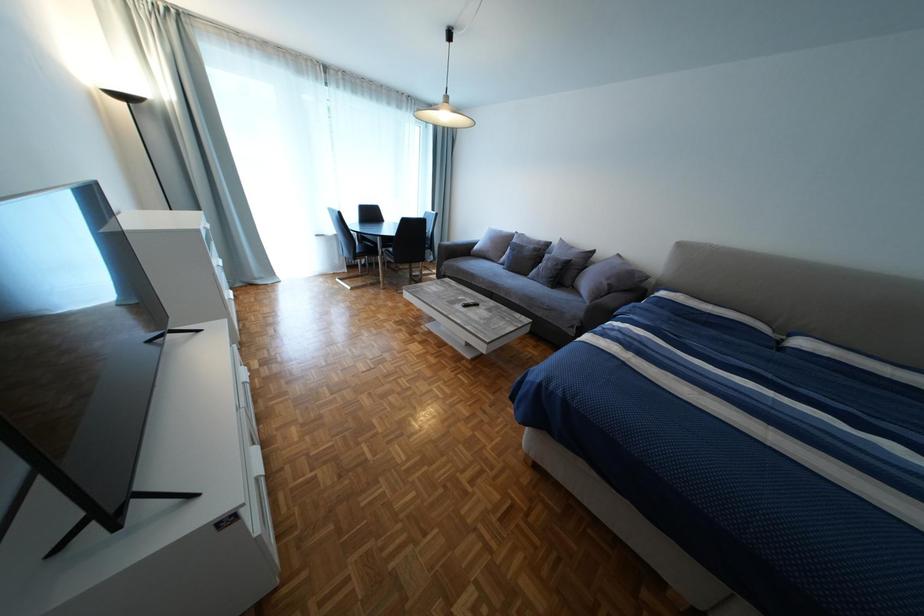
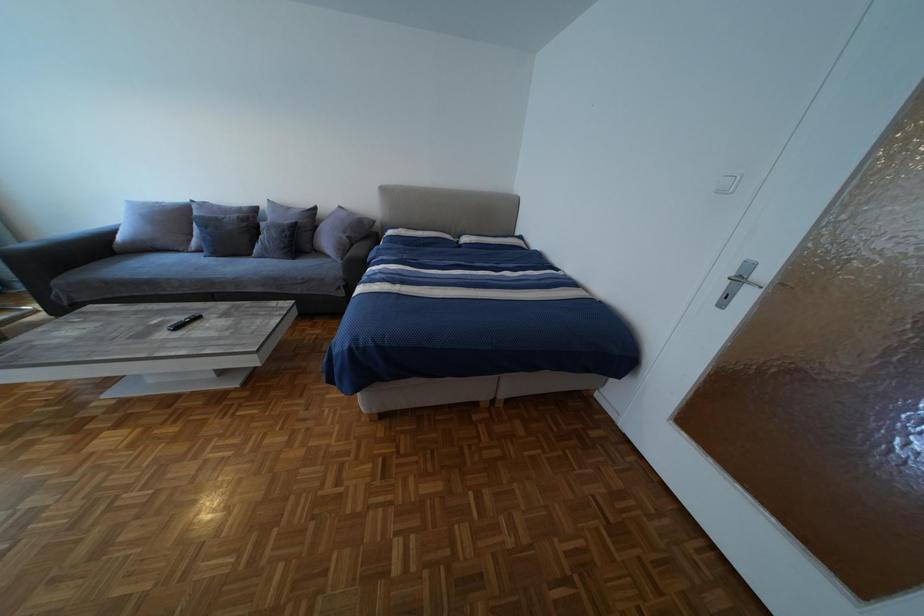
The images are taken continuously from a first-person perspective. In which direction is your viewpoint rotating?

The camera rotated toward right-down.